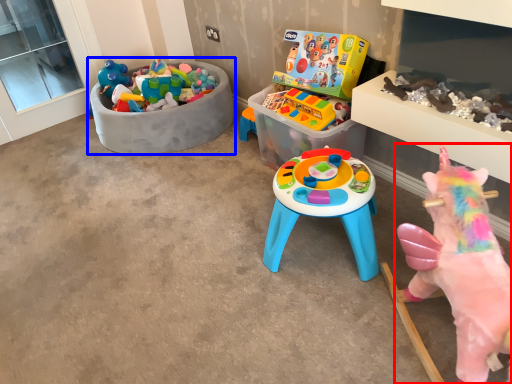
Question: Which of the following is the farthest to the observer, toy (highlighted by a red box) or toy (highlighted by a blue box)?

Choices:
 (A) toy
 (B) toy

Answer: (B)